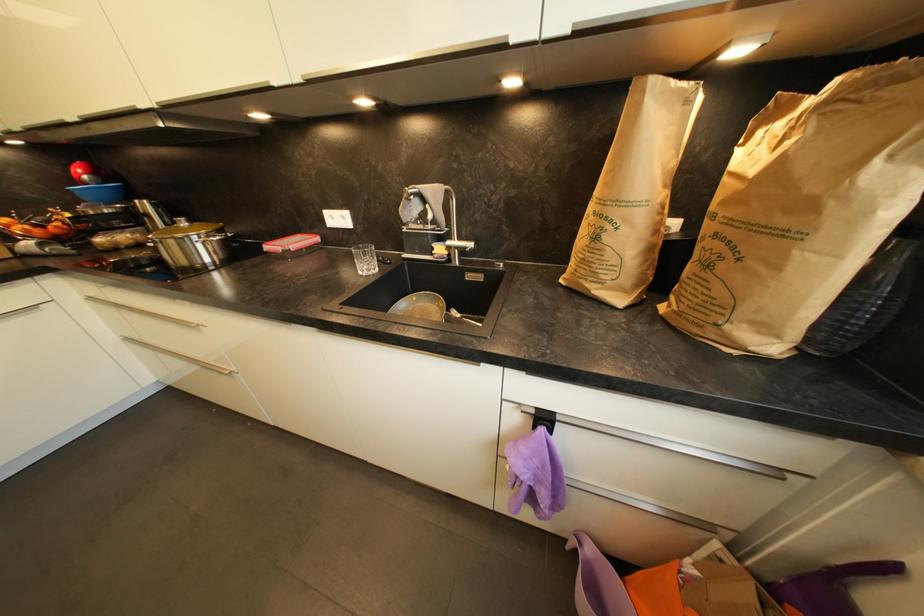
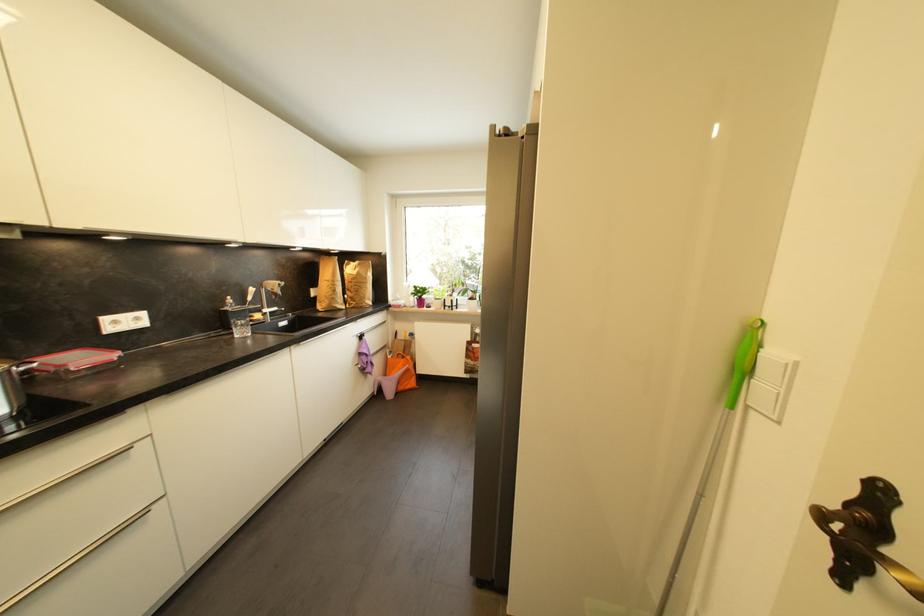
Find the pixel in the second image that matches point (348, 219) in the first image.

(142, 321)